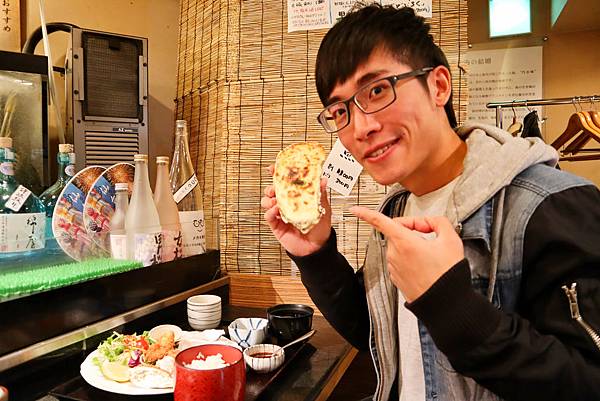
This screenshot has height=401, width=600. I want to click on laminated notices(in japanese.), so click(x=502, y=86), click(x=304, y=15), click(x=337, y=8), click(x=414, y=4).